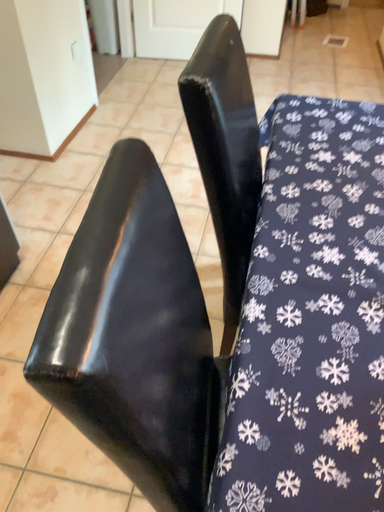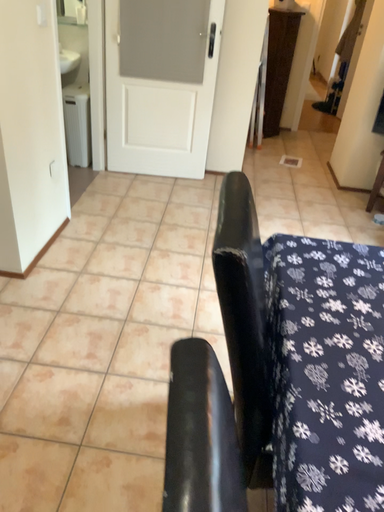
Question: Which way did the camera rotate in the video?

Choices:
 (A) rotated left
 (B) rotated right

Answer: (B)